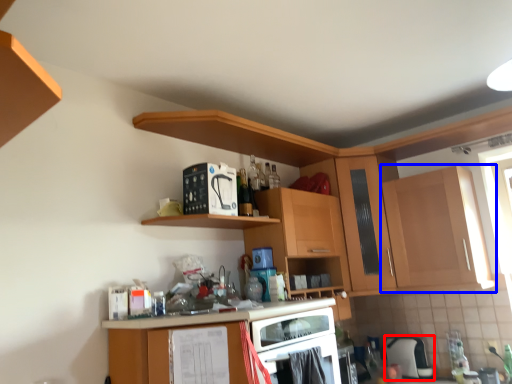
Question: Which of the following is the closest to the observer, appliance (highlighted by a red box) or cabinetry (highlighted by a blue box)?

Choices:
 (A) appliance
 (B) cabinetry

Answer: (B)